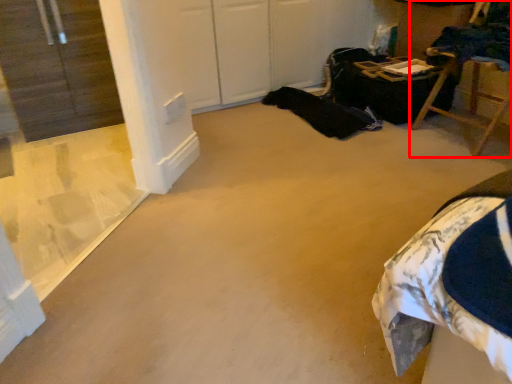
Question: Where is furniture (annotated by the red box) located in relation to window in the image?

Choices:
 (A) left
 (B) right

Answer: (B)